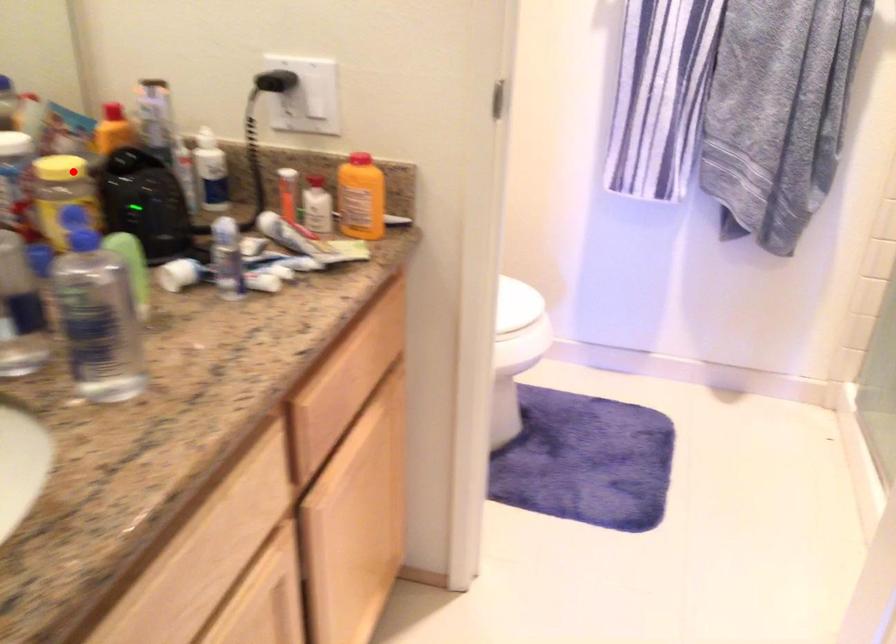
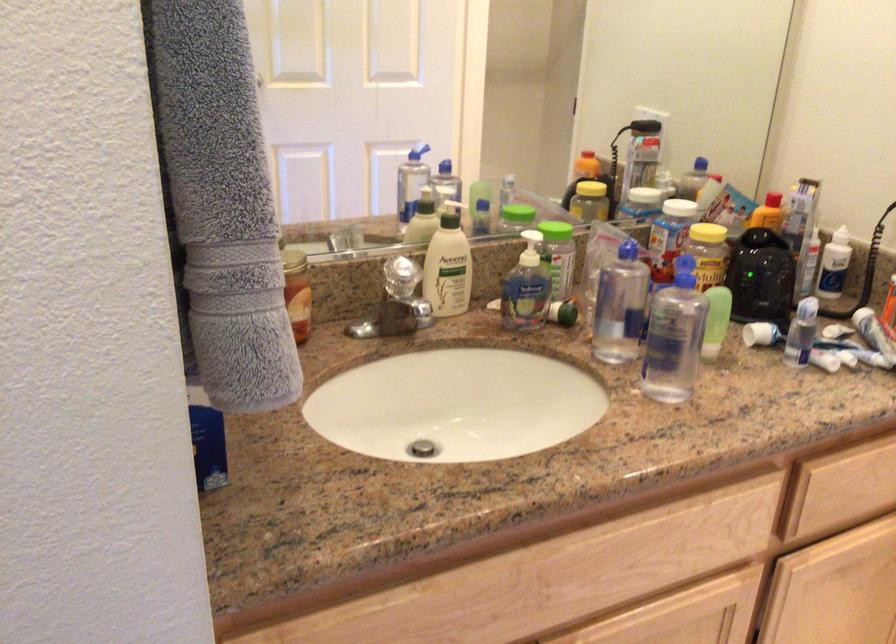
Question: I am providing you with two images of the same scene from different viewpoints. Given a red point in image1, look at the same physical point in image2. Is it:

Choices:
 (A) Closer to the viewpoint
 (B) Farther from the viewpoint

Answer: (B)